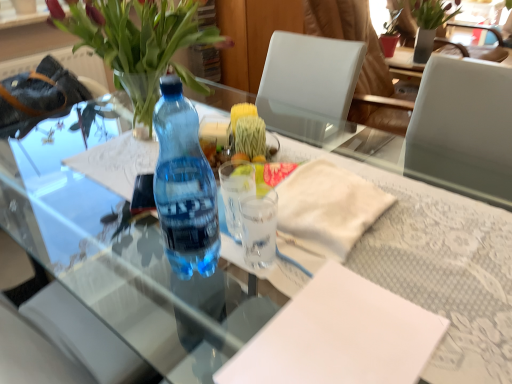
Question: From a real-world perspective, is transparent glass cup at center, the 2th coffee cup positioned from the front, over translucent glass vase at upper left?

Choices:
 (A) yes
 (B) no

Answer: (B)

Question: Is transparent glass cup at center, arranged as the first coffee cup when viewed from the back, thinner than translucent glass vase at upper left?

Choices:
 (A) no
 (B) yes

Answer: (B)

Question: Is transparent glass cup at center, the 2th coffee cup positioned from the front, positioned with its back to translucent glass vase at upper left?

Choices:
 (A) no
 (B) yes

Answer: (A)

Question: From the image's perspective, is transparent glass cup at center, arranged as the first coffee cup when viewed from the back, below translucent glass vase at upper left?

Choices:
 (A) no
 (B) yes

Answer: (B)

Question: Is transparent glass cup at center, arranged as the first coffee cup when viewed from the back, shorter than translucent glass vase at upper left?

Choices:
 (A) no
 (B) yes

Answer: (B)

Question: From a real-world perspective, does transparent glass cup at center, arranged as the first coffee cup when viewed from the back, sit lower than translucent glass vase at upper left?

Choices:
 (A) yes
 (B) no

Answer: (A)

Question: Does transparent glass cup at center, acting as the 1th coffee cup starting from the front, have a smaller size compared to green matte vase at upper right?

Choices:
 (A) no
 (B) yes

Answer: (B)

Question: Are transparent glass cup at center, acting as the 1th coffee cup starting from the front, and green matte vase at upper right beside each other?

Choices:
 (A) no
 (B) yes

Answer: (A)

Question: Is transparent glass cup at center, acting as the 1th coffee cup starting from the front, completely or partially outside of green matte vase at upper right?

Choices:
 (A) no
 (B) yes

Answer: (B)

Question: Is transparent glass cup at center, which is the second coffee cup from back to front, thinner than green matte vase at upper right?

Choices:
 (A) no
 (B) yes

Answer: (B)

Question: Does transparent glass cup at center, which is the second coffee cup from back to front, lie in front of green matte vase at upper right?

Choices:
 (A) no
 (B) yes

Answer: (B)

Question: From a real-world perspective, is transparent glass cup at center, which is the second coffee cup from back to front, located higher than green matte vase at upper right?

Choices:
 (A) yes
 (B) no

Answer: (A)

Question: Does white paper at center, the first notepad when ordered from top to bottom, come in front of translucent glass vase at upper left?

Choices:
 (A) yes
 (B) no

Answer: (A)